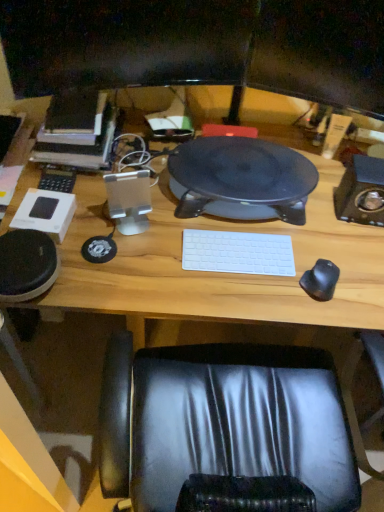
The height and width of the screenshot is (512, 384). What are the coordinates of `blank space situated above hardcover book at left (from a real-world perspective)` in the screenshot? It's located at (72, 113).